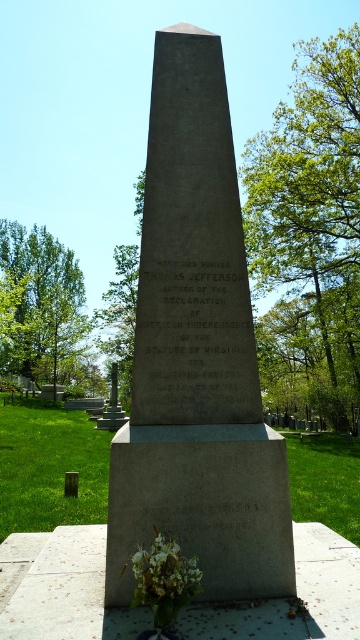
Question: Does green leafy tree at upper right come behind white matte flowers at lower center?

Choices:
 (A) yes
 (B) no

Answer: (A)

Question: Is green leafy tree at upper right bigger than white matte flowers at lower center?

Choices:
 (A) yes
 (B) no

Answer: (A)

Question: Based on their relative distances, which object is farther from the green leafy tree at upper right?

Choices:
 (A) green leafy tree at left
 (B) white matte flowers at lower center

Answer: (B)

Question: Among these objects, which one is farthest from the camera?

Choices:
 (A) green leafy tree at upper right
 (B) white matte flowers at lower center
 (C) green leafy tree at left

Answer: (A)

Question: Among these objects, which one is farthest from the camera?

Choices:
 (A) green leafy tree at upper right
 (B) green leafy tree at left

Answer: (A)

Question: Is green leafy tree at upper right behind green leafy tree at left?

Choices:
 (A) yes
 (B) no

Answer: (A)